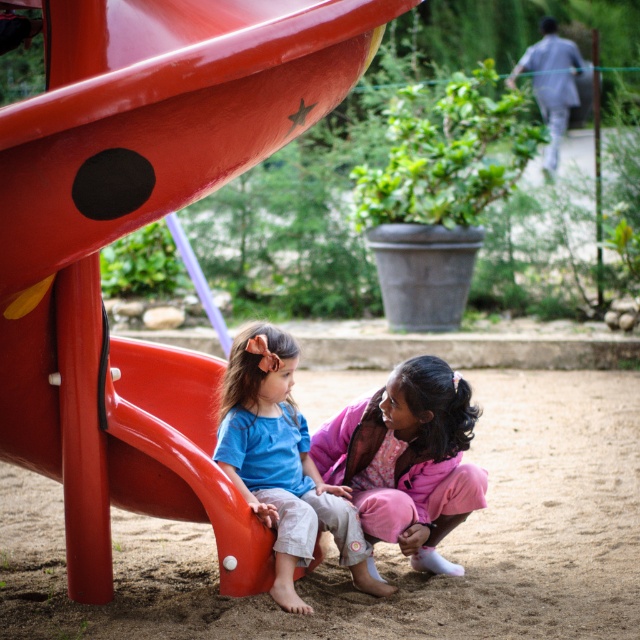
Question: Does sandy brown at lower center have a lesser width compared to pink fabric dress at lower center?

Choices:
 (A) no
 (B) yes

Answer: (A)

Question: Can you confirm if pink fabric dress at lower center is bigger than blue cotton shirt at lower left?

Choices:
 (A) yes
 (B) no

Answer: (B)

Question: Which of the following is the closest to the observer?

Choices:
 (A) (609, 412)
 (B) (410, 525)
 (C) (154, 120)
 (D) (216, 456)

Answer: (C)

Question: Does sandy brown at lower center appear under blue cotton shirt at lower left?

Choices:
 (A) no
 (B) yes

Answer: (B)

Question: Which point appears closest to the camera in this image?

Choices:
 (A) (538, 621)
 (B) (433, 380)
 (C) (346, 557)
 (D) (179, 134)

Answer: (D)

Question: Which object is positioned closest to the smooth plastic slide at center?

Choices:
 (A) sandy brown at lower center
 (B) blue cotton shirt at lower left
 (C) pink fabric dress at lower center

Answer: (B)